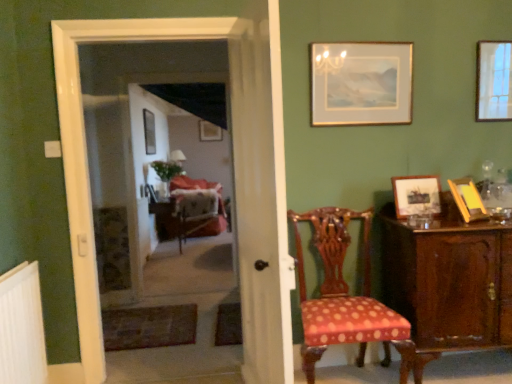
Question: Is mahogany cabinet at right bigger or smaller than velvet upholstered armchair at center?

Choices:
 (A) small
 (B) big

Answer: (B)

Question: In the image, is mahogany cabinet at right positioned in front of or behind velvet upholstered armchair at center?

Choices:
 (A) behind
 (B) front

Answer: (B)

Question: Which object is positioned farthest from the wooden picture frame at upper right, placed as the sixth picture frame when sorted from left to right?

Choices:
 (A) wooden picture frame at right, acting as the fourth picture frame starting from the left
 (B) white plastic radiator at lower left
 (C) metallic silver picture frame at center, which appears as the second picture frame when viewed from the back
 (D) matte black screen door at center
 (E) mahogany cabinet at right

Answer: (C)

Question: Estimate the real-world distances between objects in this image. Which object is closer to the polka dot fabric chair at center?

Choices:
 (A) gold-framed picture at upper right, which ranks as the third picture frame in front-to-back order
 (B) wooden picture frame at upper right, acting as the 3th picture frame starting from the back
 (C) white glossy door at center
 (D) white sheer curtain at center
 (E) matte black screen door at center

Answer: (D)